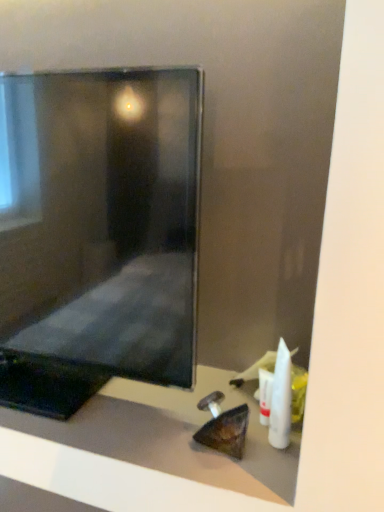
Question: Relative to matte black monitor at center, is white plastic tube at lower right, the second toiletry viewed from the front, in front or behind?

Choices:
 (A) behind
 (B) front

Answer: (A)

Question: Based on their positions, is white plastic tube at lower right, placed as the 1th toiletry when sorted from back to front, located to the left or right of matte black monitor at center?

Choices:
 (A) right
 (B) left

Answer: (A)

Question: Which object is the closest to the white plastic toothbrush at lower right, which is the second toiletry in back-to-front order?

Choices:
 (A) white plastic tube at lower right, the second toiletry viewed from the front
 (B) matte black monitor at center
 (C) matte black monitor at center

Answer: (A)

Question: Which is farther from the white plastic tube at lower right, placed as the 1th toiletry when sorted from back to front?

Choices:
 (A) matte black monitor at center
 (B) white plastic toothbrush at lower right, which is the second toiletry in back-to-front order
 (C) matte black monitor at center

Answer: (A)